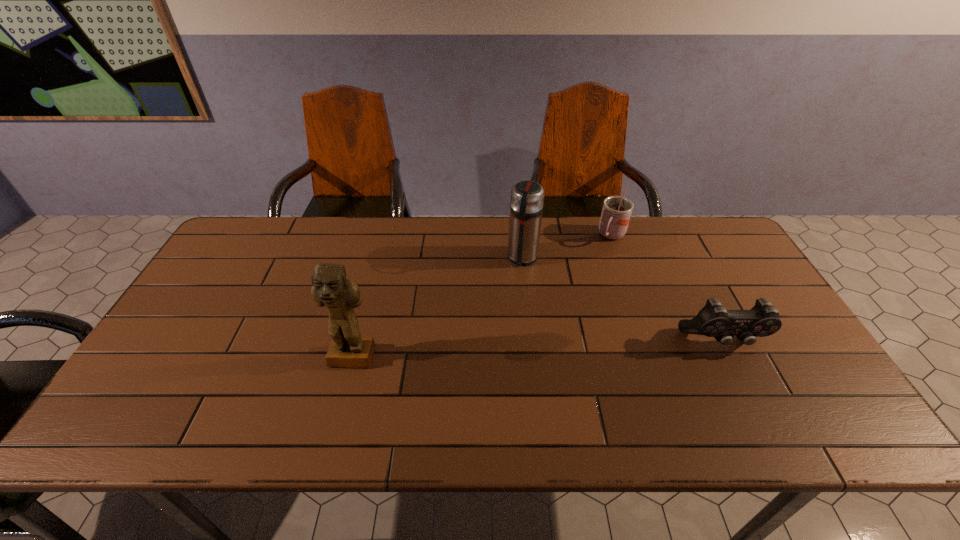
The image size is (960, 540). I want to click on free spot on the desktop that is between the leftmost object and the rightmost object and is positioned on the side with the handle of the second object from right to left, so click(x=534, y=350).

In order to click on vacant space on the desktop that is between the leftmost object and the rightmost object and is positioned with a handle on the side of the third shortest object in this screenshot , I will do `click(492, 352)`.